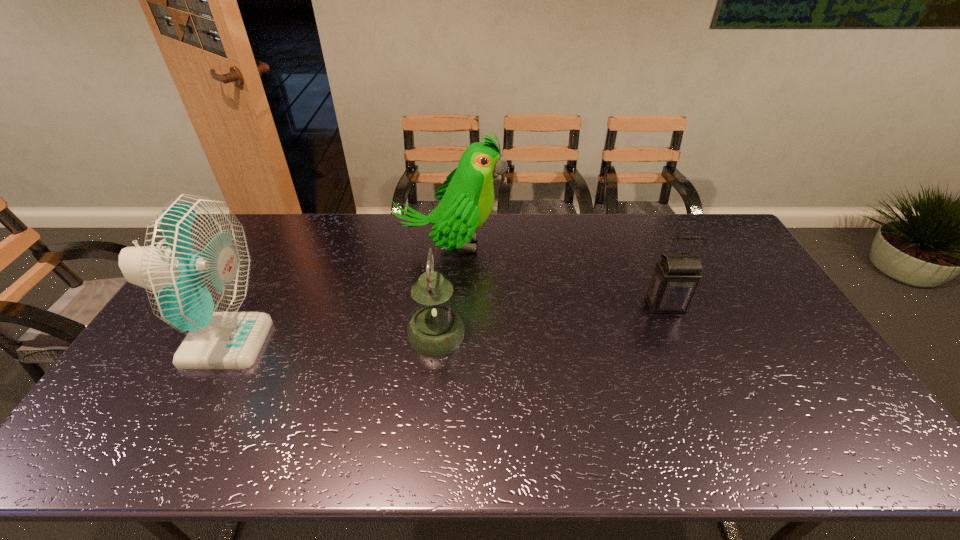
At what (x,y) coordinates should I click in order to perform the action: click on vacant region at the far edge of the desktop. Please return your answer as a coordinate pair (x, y). The image size is (960, 540). Looking at the image, I should click on (593, 213).

In the image, there is a desktop. Identify the location of vacant area at the near edge. (503, 437).

You are a GUI agent. You are given a task and a screenshot of the screen. Output one action in this format:
    pyautogui.click(x=<x>, y=<y>)
    Task: Click on the vacant space at the right edge of the desktop
    
    Given the screenshot: What is the action you would take?
    pyautogui.click(x=725, y=270)

In the image, there is a desktop. At what (x,y) coordinates should I click in order to perform the action: click on free space at the far right corner. Please return your answer as a coordinate pair (x, y). The width and height of the screenshot is (960, 540). Looking at the image, I should click on (696, 234).

Locate an element on the screen. free spot between the fan and the farthest object is located at coordinates (338, 294).

Where is `vacant region between the farthest object and the rightmost object`? This screenshot has width=960, height=540. vacant region between the farthest object and the rightmost object is located at coordinates (558, 275).

You are a GUI agent. You are given a task and a screenshot of the screen. Output one action in this format:
    pyautogui.click(x=<x>, y=<y>)
    Task: Click on the unoccupied area between the right lantern and the left lantern
    Image resolution: width=960 pixels, height=540 pixels.
    Given the screenshot: What is the action you would take?
    pyautogui.click(x=551, y=320)

What are the coordinates of `vacant space in between the farthest object and the leftmost object` in the screenshot? It's located at (338, 294).

Locate an element on the screen. free space between the leftmost object and the left lantern is located at coordinates (330, 339).

Select which object is the second closest to the right lantern. Please provide its 2D coordinates. Your answer should be formatted as a tuple, i.e. [(x, y)], where the tuple contains the x and y coordinates of a point satisfying the conditions above.

[(435, 330)]